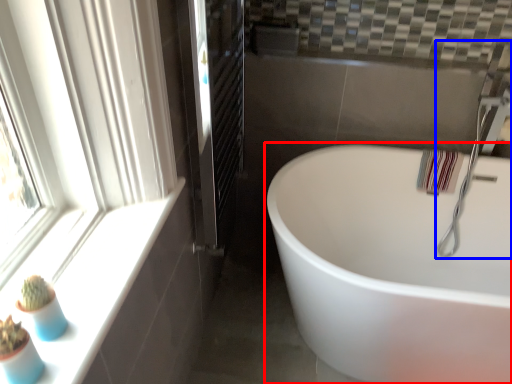
Question: Among these objects, which one is farthest to the camera, bathtub (highlighted by a red box) or faucet (highlighted by a blue box)?

Choices:
 (A) bathtub
 (B) faucet

Answer: (B)